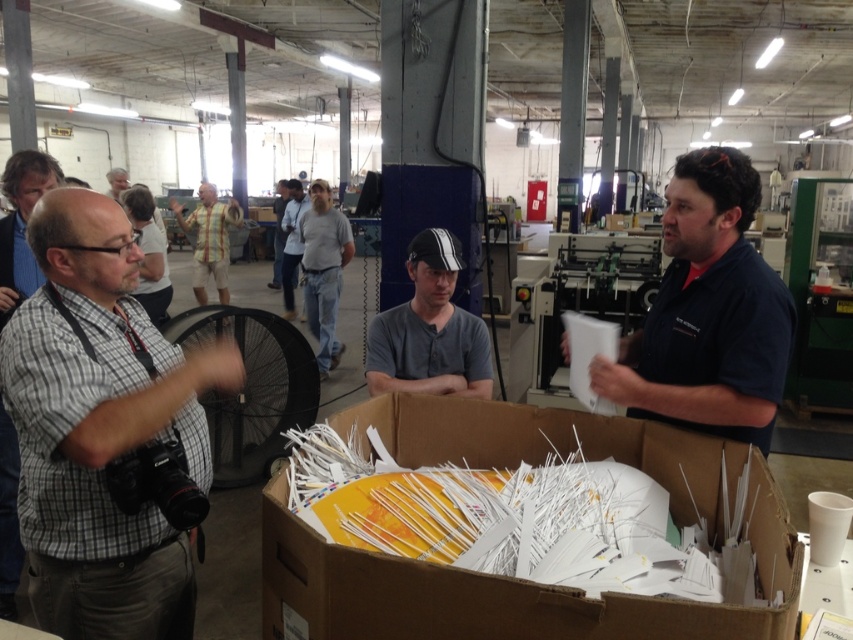
The image size is (853, 640). Describe the element at coordinates (102, 429) in the screenshot. I see `gray checkered shirt at left` at that location.

Is gray checkered shirt at left positioned in front of dark gray shirt at center?

Yes, gray checkered shirt at left is in front of dark gray shirt at center.

Find the location of a particular element. The image size is (853, 640). gray checkered shirt at left is located at coordinates (102, 429).

Can you confirm if yellow striped shirt at upper center is smaller than light blue shirt at center?

Yes, yellow striped shirt at upper center is smaller than light blue shirt at center.

Is yellow striped shirt at upper center positioned in front of light blue shirt at center?

No, yellow striped shirt at upper center is behind light blue shirt at center.

Describe the element at coordinates (209, 240) in the screenshot. This screenshot has width=853, height=640. I see `yellow striped shirt at upper center` at that location.

This screenshot has width=853, height=640. Find the location of `yellow striped shirt at upper center`. yellow striped shirt at upper center is located at coordinates (209, 240).

At what (x,y) coordinates should I click in order to perform the action: click on gray cotton shirt at center. Please return your answer as a coordinate pair (x, y). Looking at the image, I should click on (277, 232).

Is gray cotton shirt at center below gray fabric shirt at upper left?

Yes, gray cotton shirt at center is below gray fabric shirt at upper left.

Find the location of `gray cotton shirt at center`. gray cotton shirt at center is located at coordinates (277, 232).

This screenshot has width=853, height=640. Identify the location of gray cotton shirt at center. (277, 232).